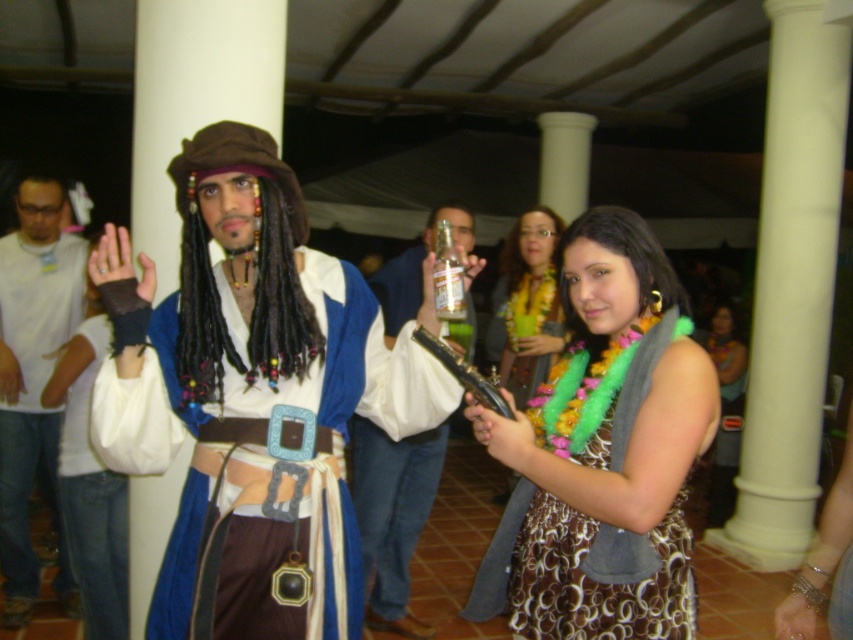
You are at a costume party and see two items at the center of the room. The blue velvet robe at center and the fluffy green boa at center. Which one is more to the left?

The blue velvet robe at center is more to the left than the fluffy green boa at center.